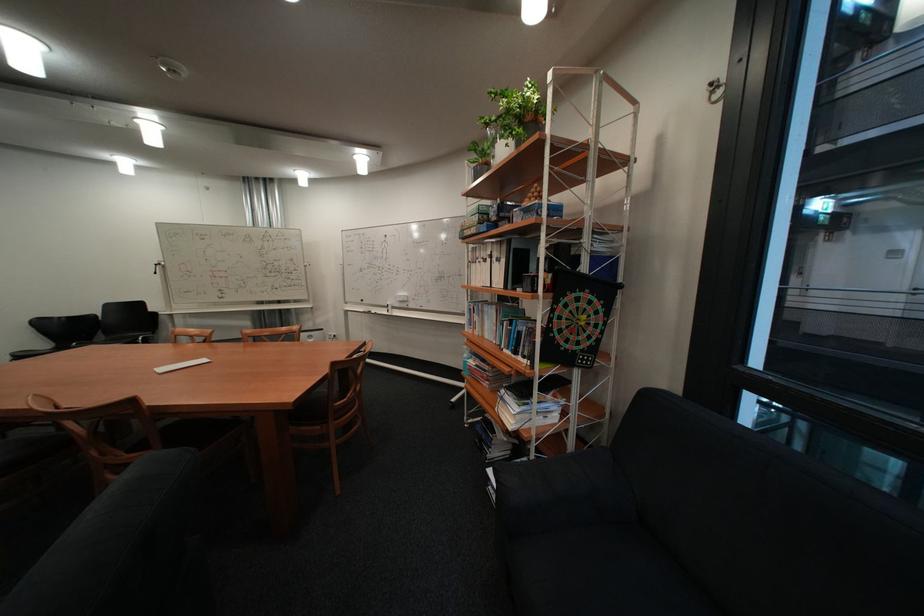
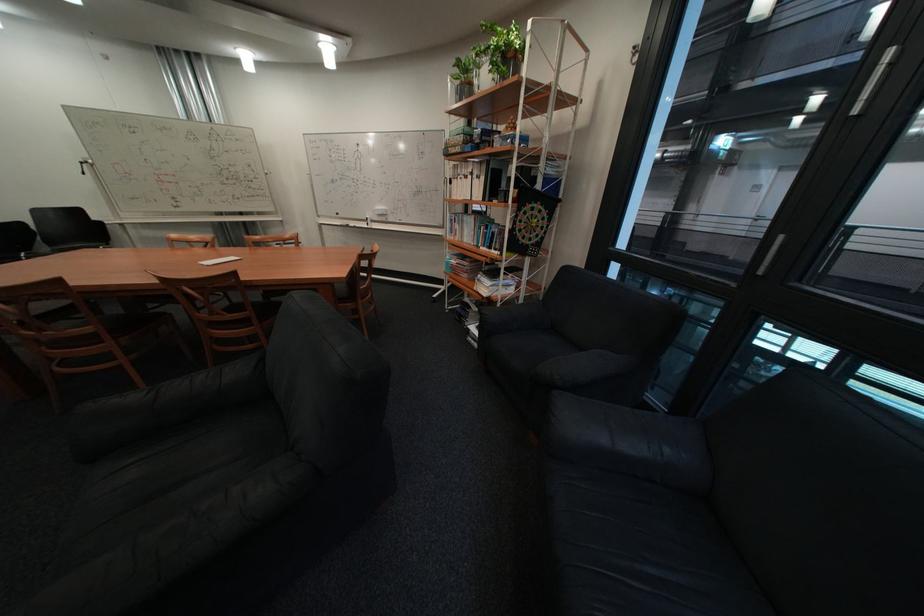
Locate, in the second image, the point that corresponds to point 490,161 in the first image.

(472, 79)